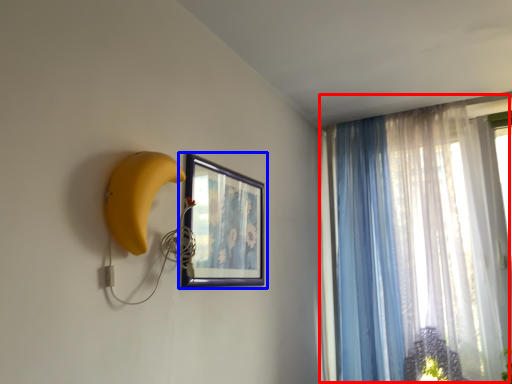
Question: Which object is closer to the camera taking this photo, curtain (highlighted by a red box) or picture frame (highlighted by a blue box)?

Choices:
 (A) curtain
 (B) picture frame

Answer: (B)